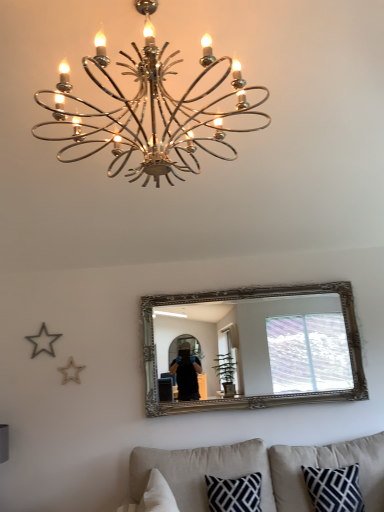
Question: From a real-world perspective, is beige fabric couch at lower center physically located above or below chrome/metallic chandelier at upper center?

Choices:
 (A) above
 (B) below

Answer: (B)

Question: From the image's perspective, is beige fabric couch at lower center above or below chrome/metallic chandelier at upper center?

Choices:
 (A) above
 (B) below

Answer: (B)

Question: Estimate the real-world distances between objects in this image. Which object is closer to the navy blue textured pillow at lower right?

Choices:
 (A) silver/gilded mirror at center
 (B) beige fabric couch at lower center
 (C) chrome/metallic chandelier at upper center

Answer: (B)

Question: Which of these objects is positioned farthest from the beige fabric couch at lower center?

Choices:
 (A) silver/gilded mirror at center
 (B) chrome/metallic chandelier at upper center
 (C) navy blue textured pillow at lower right

Answer: (B)